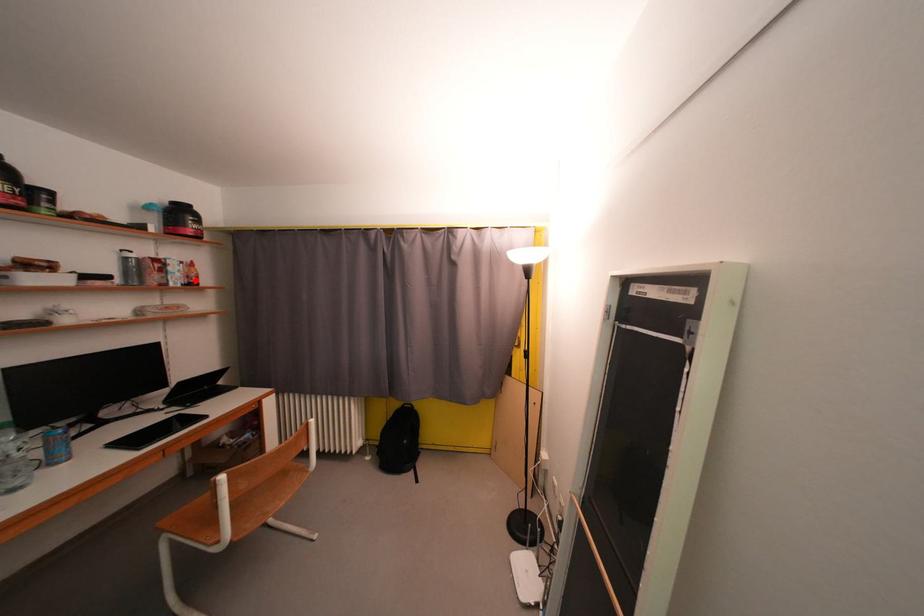
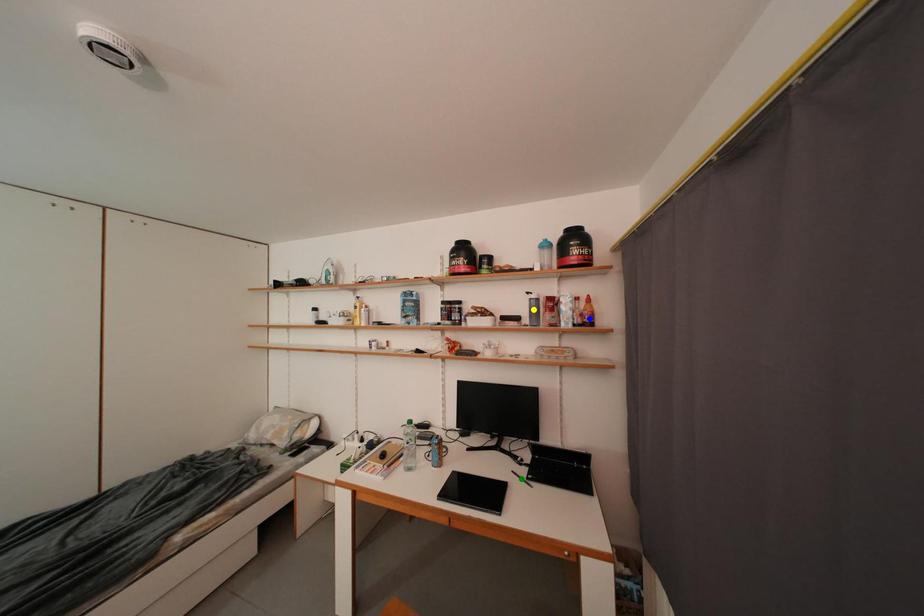
Question: I am providing you with two images of the same scene from different viewpoints. A red point is marked on the first image. You are given multiple points on the second image. Can you choose the point in image 2 that corresponds to the point in image 1?

Choices:
 (A) yellow point
 (B) blue point
 (C) green point

Answer: (B)